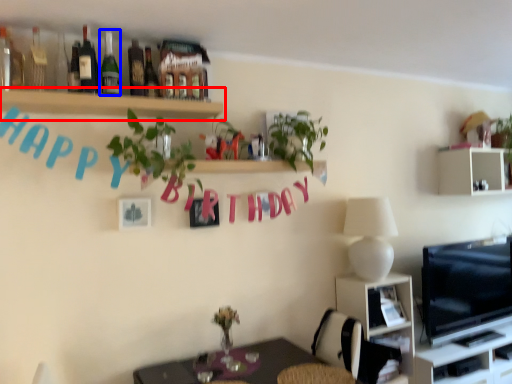
Question: Which of the following is the farthest to the observer, shelf (highlighted by a red box) or bottle (highlighted by a blue box)?

Choices:
 (A) shelf
 (B) bottle

Answer: (B)